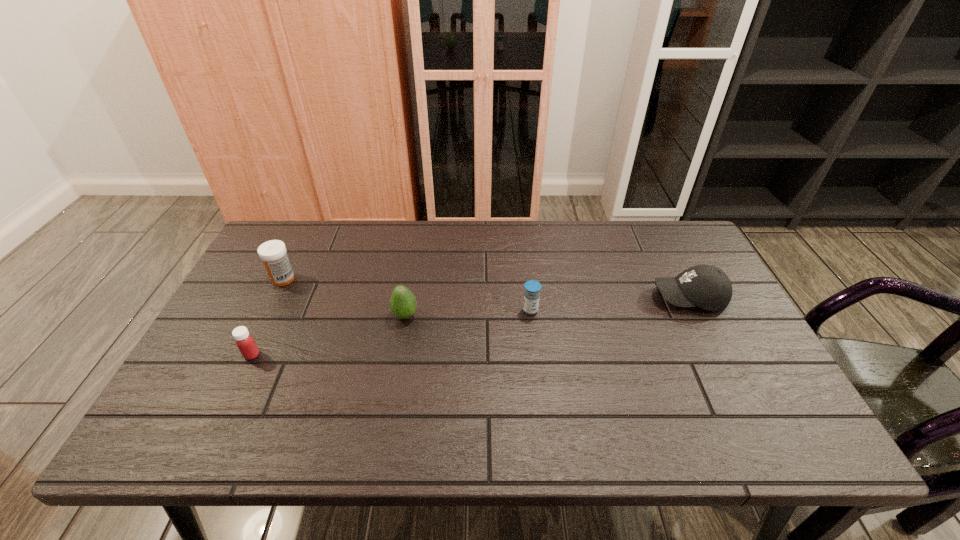
In order to click on vacant space located 0.250m on the front-facing side of the baseball cap in this screenshot , I will do `click(564, 298)`.

Where is `vacant area situated 0.360m on the back of the second nearest medicine`? Image resolution: width=960 pixels, height=540 pixels. vacant area situated 0.360m on the back of the second nearest medicine is located at coordinates (521, 228).

Identify the location of vacant space located on the left of the nearest object. The image size is (960, 540). (204, 355).

You are a GUI agent. You are given a task and a screenshot of the screen. Output one action in this format:
    pyautogui.click(x=<x>, y=<y>)
    Task: Click on the object at the right edge
    This screenshot has height=540, width=960.
    Given the screenshot: What is the action you would take?
    pyautogui.click(x=705, y=286)

Locate an element on the screen. This screenshot has width=960, height=540. vacant space at the far edge is located at coordinates (625, 240).

Where is `free space at the near edge of the desktop`? The height and width of the screenshot is (540, 960). free space at the near edge of the desktop is located at coordinates (250, 434).

Image resolution: width=960 pixels, height=540 pixels. In the image, there is a desktop. Identify the location of free region at the left edge. (267, 289).

Where is `vacant space at the right edge of the desktop`? vacant space at the right edge of the desktop is located at coordinates (729, 325).

Where is `free space at the far left corner of the desktop`? free space at the far left corner of the desktop is located at coordinates (323, 222).

Where is `vacant space at the near right corner of the desktop`? vacant space at the near right corner of the desktop is located at coordinates (746, 442).